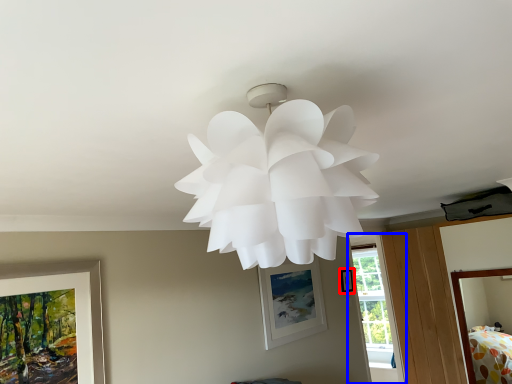
Question: Which object is closer to the camera taking this photo, picture frame (highlighted by a red box) or window (highlighted by a blue box)?

Choices:
 (A) picture frame
 (B) window

Answer: (A)